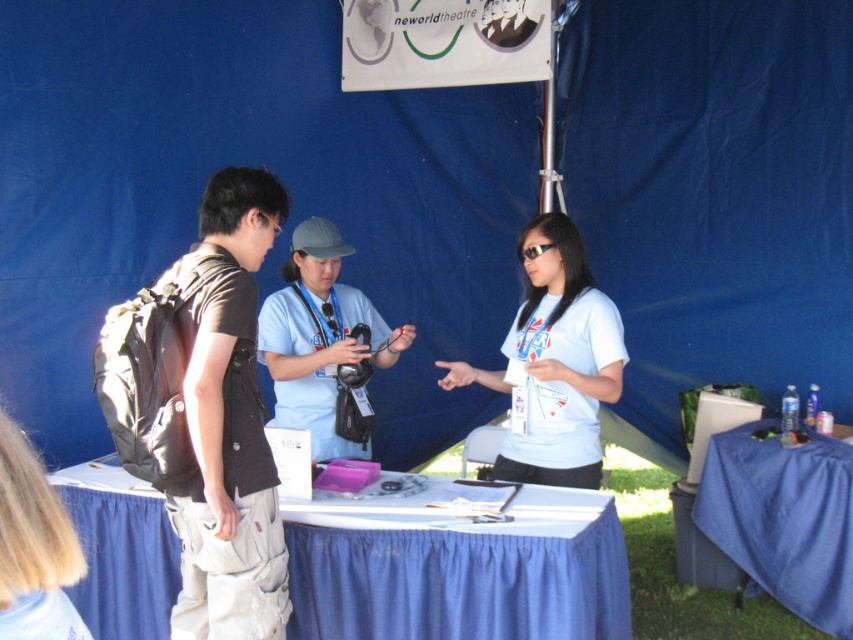
Question: Which object is farther from the camera taking this photo?

Choices:
 (A) blue fabric table at lower right
 (B) dark brown fabric backpack at left
 (C) blue fabric table at center
 (D) light blue fabric shirt at center

Answer: (A)

Question: Among these points, which one is farthest from the camera?

Choices:
 (A) (322, 273)
 (B) (221, 416)

Answer: (A)

Question: From the image, what is the correct spatial relationship of dark brown fabric backpack at left in relation to light blue fabric shirt at center?

Choices:
 (A) left
 (B) right

Answer: (A)

Question: Is white matte t-shirt at center bigger than blue fabric table at lower right?

Choices:
 (A) no
 (B) yes

Answer: (B)

Question: Among these objects, which one is nearest to the camera?

Choices:
 (A) light blue fabric shirt at center
 (B) blue fabric table at center
 (C) blue fabric table at lower right

Answer: (B)

Question: Can you confirm if dark brown fabric backpack at left is thinner than blue fabric table at lower right?

Choices:
 (A) no
 (B) yes

Answer: (B)